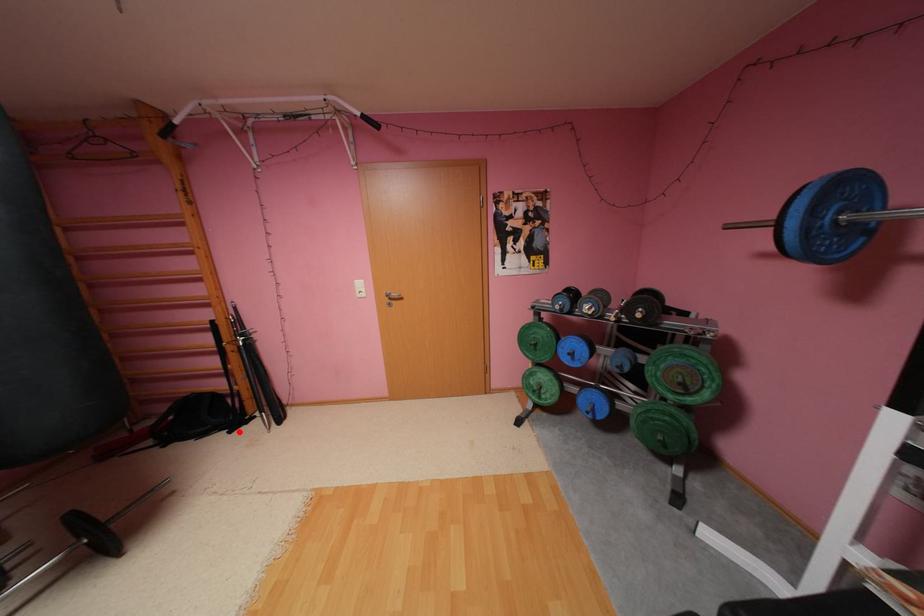
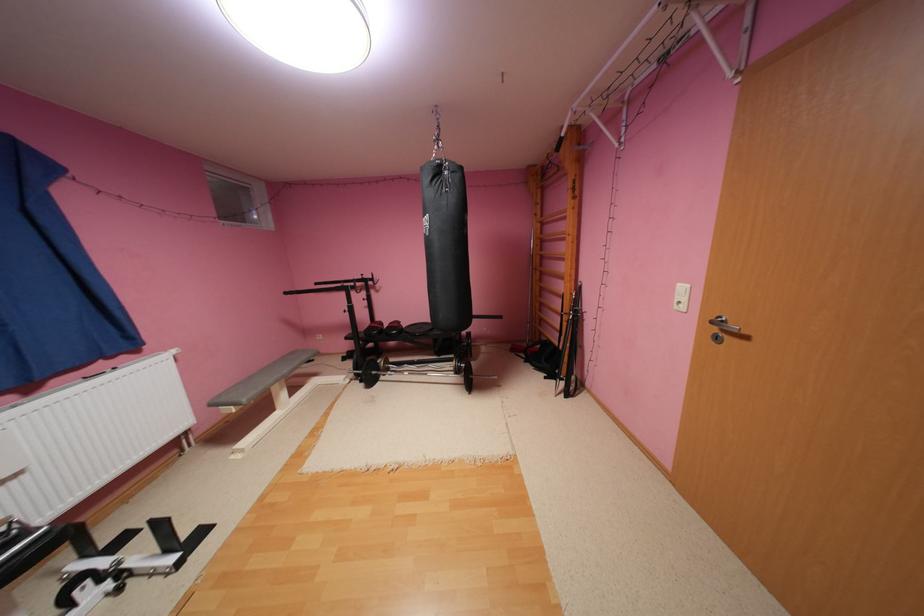
The point at the highlighted location is marked in the first image. Where is the corresponding point in the second image?

(554, 378)